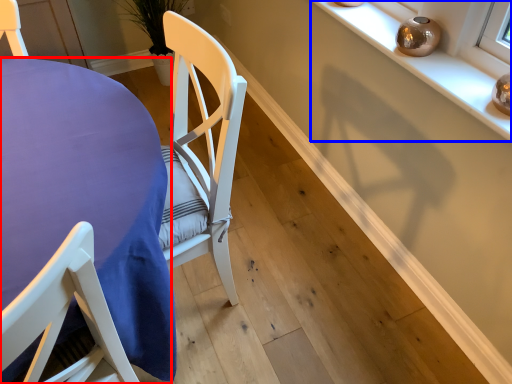
Question: Which object appears closest to the camera in this image, table (highlighted by a red box) or shelf (highlighted by a blue box)?

Choices:
 (A) table
 (B) shelf

Answer: (A)